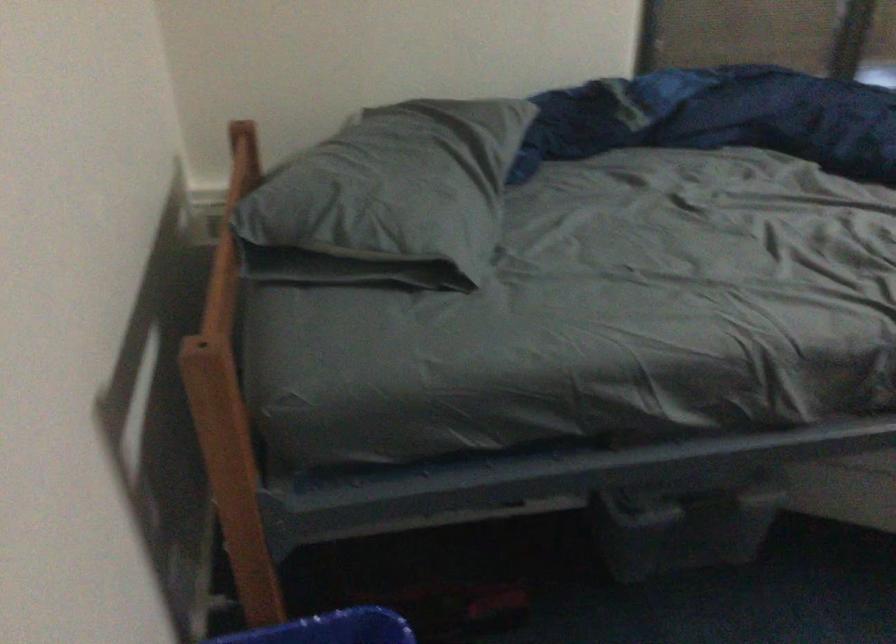
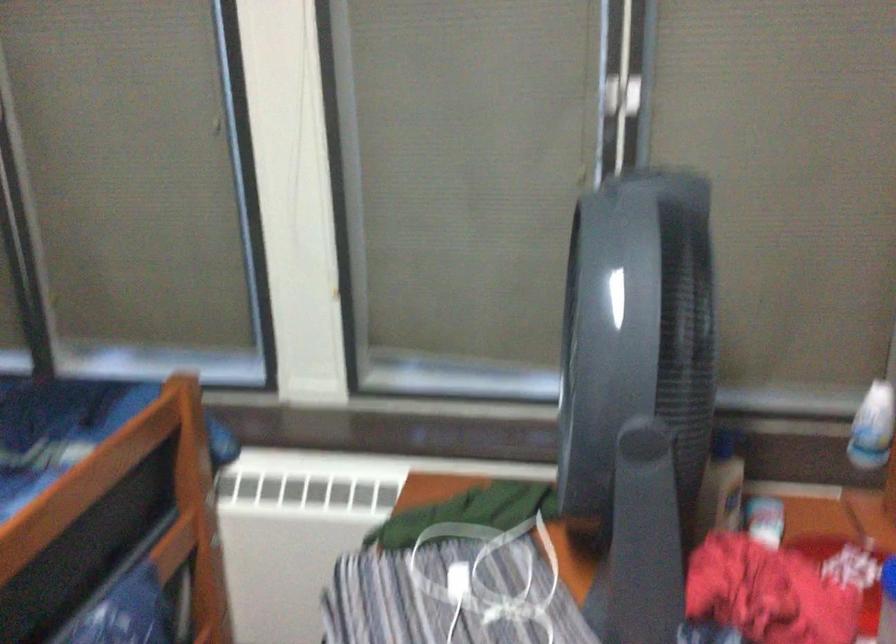
Question: Which direction would the cameraman need to move to produce the second image? Reply with the corresponding letter.

Choices:
 (A) Left
 (B) Right
 (C) Forward
 (D) Backward

Answer: (B)